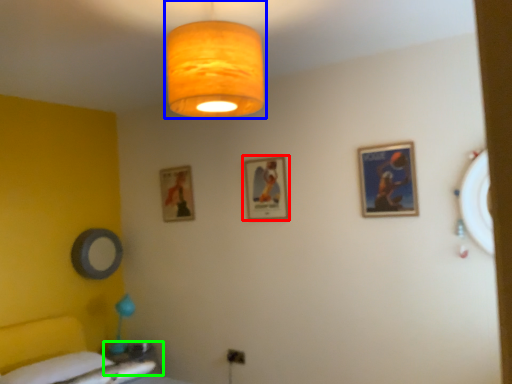
Question: Which is nearer to the picture frame (highlighted by a red box)? lamp (highlighted by a blue box) or table (highlighted by a green box).

Choices:
 (A) lamp
 (B) table

Answer: (A)